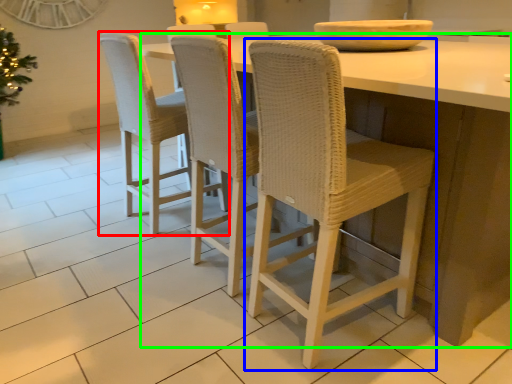
Question: Which object is the closest to the chair (highlighted by a red box)? Choose among these: chair (highlighted by a blue box) or table (highlighted by a green box).

Choices:
 (A) chair
 (B) table

Answer: (A)